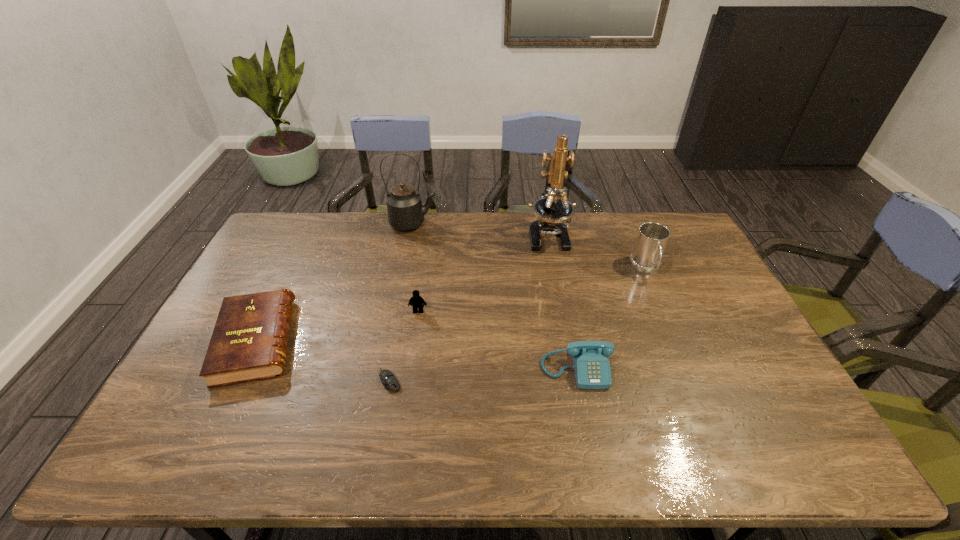
You are a GUI agent. You are given a task and a screenshot of the screen. Output one action in this format:
    pyautogui.click(x=<x>, y=<y>)
    Task: Click on the free area in between the tallest object and the third tallest object
    
    Given the screenshot: What is the action you would take?
    pyautogui.click(x=597, y=252)

Where is `unoccupied position between the rightmost object and the shortest object`? The image size is (960, 540). unoccupied position between the rightmost object and the shortest object is located at coordinates (518, 325).

Where is `vacant point located between the third tallest object and the hardback book`? The width and height of the screenshot is (960, 540). vacant point located between the third tallest object and the hardback book is located at coordinates (451, 305).

What are the coordinates of `vacant region between the sixth shortest object and the Lego` in the screenshot? It's located at (416, 267).

Where is `object that can be found as the third closest to the telephone`? object that can be found as the third closest to the telephone is located at coordinates (390, 382).

You are a GUI agent. You are given a task and a screenshot of the screen. Output one action in this format:
    pyautogui.click(x=<x>, y=<y>)
    Task: Click on the object that can be found as the sixth closest to the leftmost object
    The image size is (960, 540).
    Given the screenshot: What is the action you would take?
    pyautogui.click(x=652, y=238)